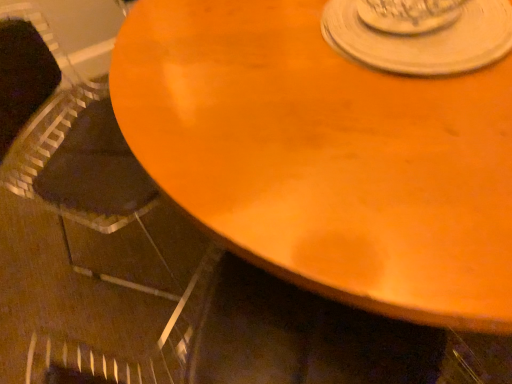
Question: Is black fabric armchair at left turned away from white matte saucer at upper center?

Choices:
 (A) yes
 (B) no

Answer: (B)

Question: Is black fabric armchair at left not inside white matte saucer at upper center?

Choices:
 (A) yes
 (B) no

Answer: (A)

Question: Would you say black fabric armchair at left contains white matte saucer at upper center?

Choices:
 (A) no
 (B) yes

Answer: (A)

Question: Is black fabric armchair at left positioned far away from white matte saucer at upper center?

Choices:
 (A) no
 (B) yes

Answer: (B)

Question: From the image's perspective, does black fabric armchair at left appear lower than white matte saucer at upper center?

Choices:
 (A) no
 (B) yes

Answer: (B)

Question: From a real-world perspective, is wooden table at center above or below black fabric armchair at left?

Choices:
 (A) above
 (B) below

Answer: (B)

Question: Looking at their shapes, would you say wooden table at center is wider or thinner than black fabric armchair at left?

Choices:
 (A) wide
 (B) thin

Answer: (A)

Question: Is wooden table at center inside or outside of black fabric armchair at left?

Choices:
 (A) inside
 (B) outside

Answer: (B)

Question: From the image's perspective, relative to black fabric armchair at left, is wooden table at center above or below?

Choices:
 (A) above
 (B) below

Answer: (A)

Question: Visually, is black fabric armchair at left positioned to the left or to the right of wooden table at center?

Choices:
 (A) right
 (B) left

Answer: (B)

Question: From the image's perspective, is black fabric armchair at left positioned above or below wooden table at center?

Choices:
 (A) below
 (B) above

Answer: (A)

Question: Considering the positions of black fabric armchair at left and wooden table at center in the image, is black fabric armchair at left taller or shorter than wooden table at center?

Choices:
 (A) tall
 (B) short

Answer: (A)

Question: Would you say black fabric armchair at left is inside or outside wooden table at center?

Choices:
 (A) outside
 (B) inside

Answer: (A)

Question: Based on their positions, is white matte saucer at upper center located to the left or right of black fabric armchair at left?

Choices:
 (A) left
 (B) right

Answer: (B)

Question: Is white matte saucer at upper center taller or shorter than black fabric armchair at left?

Choices:
 (A) short
 (B) tall

Answer: (A)